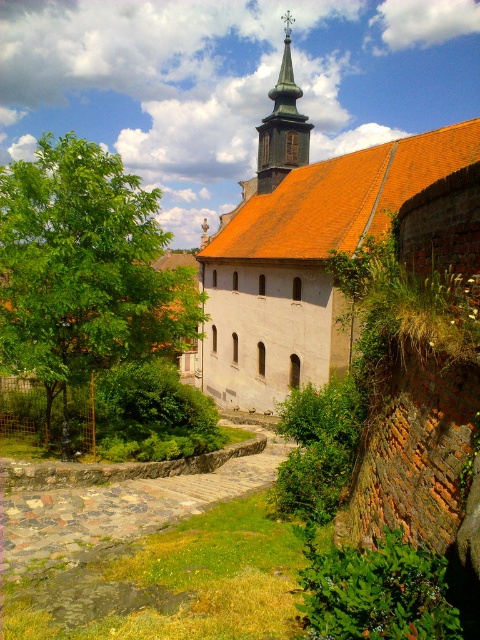
You are standing at the entrance of the church and want to take a photo of the orange tiled roof at center and the green leafy tree at left. Which object should you position to your left side in the frame to capture both in the image?

To capture both the orange tiled roof at center and the green leafy tree at left in the image, you should position the green leafy tree at left to your left side in the frame since the orange tiled roof at center is to the right of the green leafy tree at left.

You are standing at the starting point of the cobblestone pathway leading to the historic church. You see two points marked on the path ahead. The first point is at coordinates point (74, 262) and the second point is at point (288, 163). Which of these points is closer to you as you begin walking along the path?

Point (74, 262) is in front of point (288, 163), so the first point you encounter as you walk along the path will be point (74, 262).

You are standing at the entrance of the church and looking towards the orange tiled roof at center and the green leafy tree at left. Which object appears taller in the scene?

The orange tiled roof at center appears taller than the green leafy tree at left.